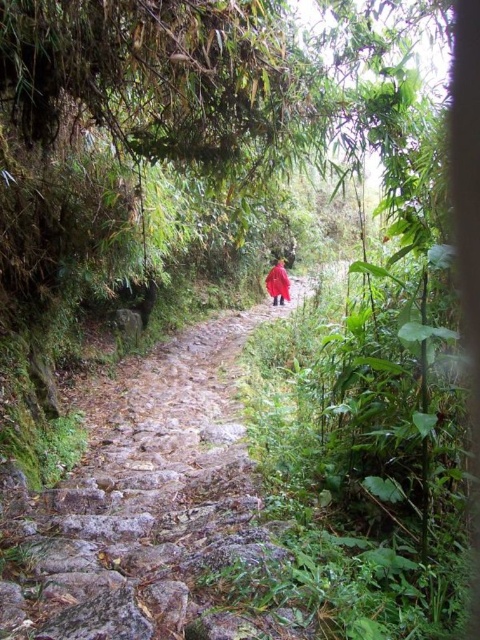
Between rustic stone steps at center and red matte jacket at center, which one appears on the left side from the viewer's perspective?

Positioned to the left is rustic stone steps at center.

What do you see at coordinates (144, 500) in the screenshot?
I see `rustic stone steps at center` at bounding box center [144, 500].

Is point (134, 518) positioned in front of point (282, 275)?

That is True.

Where is `rustic stone steps at center`? The height and width of the screenshot is (640, 480). rustic stone steps at center is located at coordinates (144, 500).